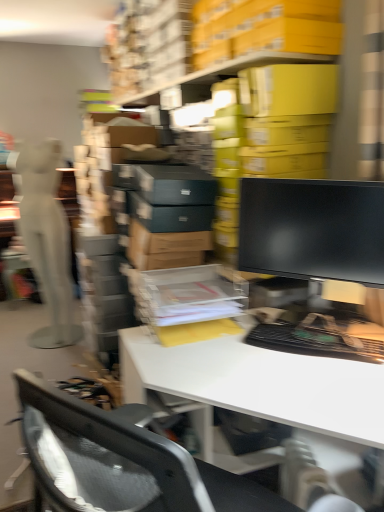
Question: Is the depth of white glossy desk at center less than that of white matte mannequin at left?

Choices:
 (A) no
 (B) yes

Answer: (B)

Question: Does white glossy desk at center have a lesser height compared to white matte mannequin at left?

Choices:
 (A) no
 (B) yes

Answer: (B)

Question: Considering the relative sizes of white glossy desk at center and white matte mannequin at left in the image provided, is white glossy desk at center smaller than white matte mannequin at left?

Choices:
 (A) yes
 (B) no

Answer: (B)

Question: Is the depth of white glossy desk at center greater than that of white matte mannequin at left?

Choices:
 (A) no
 (B) yes

Answer: (A)

Question: Considering the relative positions of white glossy desk at center and white matte mannequin at left in the image provided, is white glossy desk at center to the right of white matte mannequin at left from the viewer's perspective?

Choices:
 (A) no
 (B) yes

Answer: (B)

Question: Is white glossy desk at center wider or thinner than black glossy monitor at center?

Choices:
 (A) thin
 (B) wide

Answer: (B)

Question: Considering their positions, is white glossy desk at center located in front of or behind black glossy monitor at center?

Choices:
 (A) behind
 (B) front

Answer: (B)

Question: From the image's perspective, is white glossy desk at center above or below black glossy monitor at center?

Choices:
 (A) below
 (B) above

Answer: (A)

Question: Is point [153, 366] closer or farther from the camera than point [256, 263]?

Choices:
 (A) farther
 (B) closer

Answer: (B)

Question: In the image, is black glossy monitor at center on the left side or the right side of white matte mannequin at left?

Choices:
 (A) right
 (B) left

Answer: (A)

Question: In terms of height, does black glossy monitor at center look taller or shorter compared to white matte mannequin at left?

Choices:
 (A) short
 (B) tall

Answer: (A)

Question: Considering the positions of point (246, 181) and point (46, 230), is point (246, 181) closer or farther from the camera than point (46, 230)?

Choices:
 (A) farther
 (B) closer

Answer: (B)

Question: Is black glossy monitor at center bigger or smaller than white matte mannequin at left?

Choices:
 (A) big
 (B) small

Answer: (B)

Question: Does point (36, 203) appear closer or farther from the camera than point (279, 203)?

Choices:
 (A) closer
 (B) farther

Answer: (B)

Question: Is white matte mannequin at left taller or shorter than black glossy monitor at center?

Choices:
 (A) short
 (B) tall

Answer: (B)